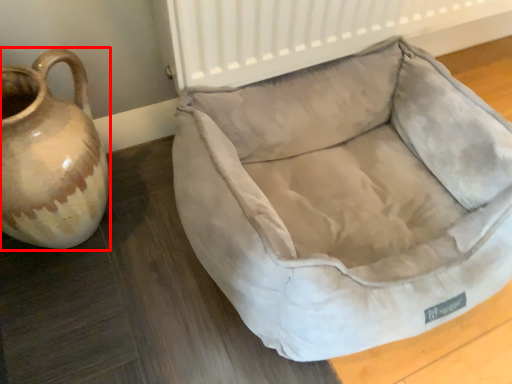
Question: Observing the image, what is the correct spatial positioning of jug (annotated by the red box) in reference to dog bed?

Choices:
 (A) right
 (B) left

Answer: (B)